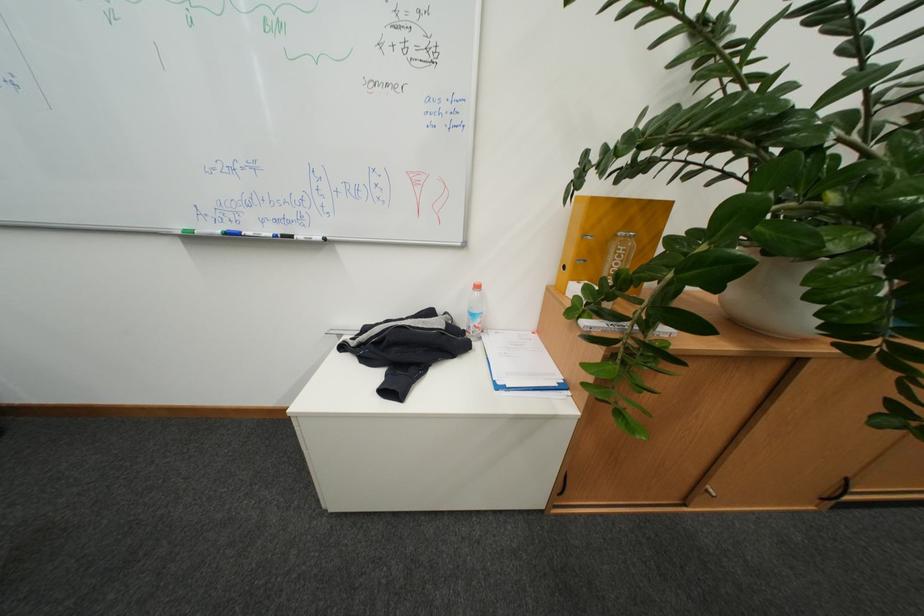
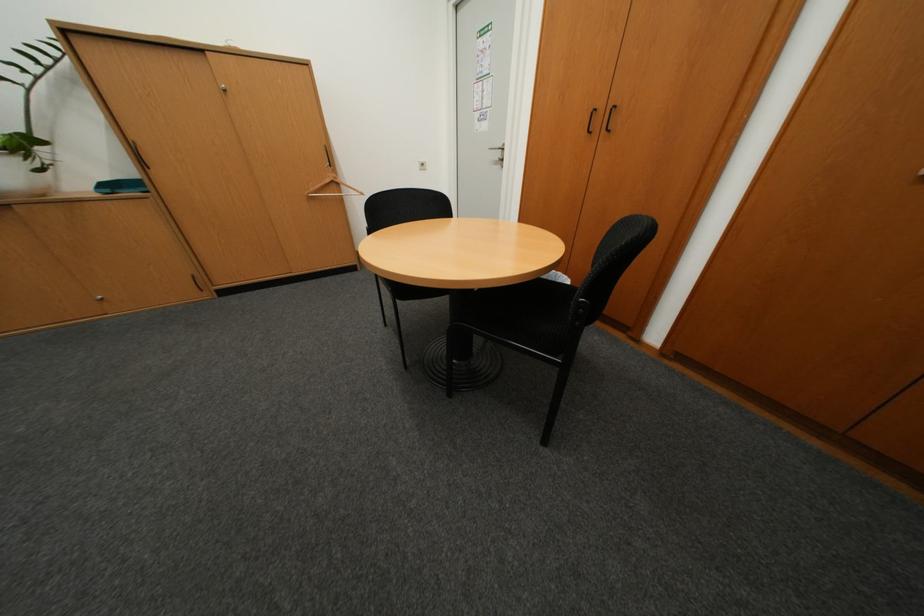
In a continuous first-person perspective shot, in which direction is the camera moving?

The movement direction of the cameraman is right, backward.